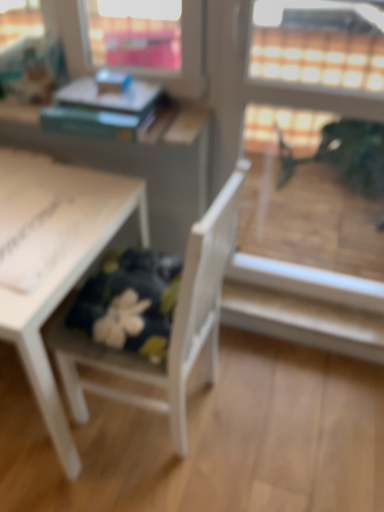
This screenshot has height=512, width=384. I want to click on spots to the right of white wood chair at lower left, so click(x=275, y=408).